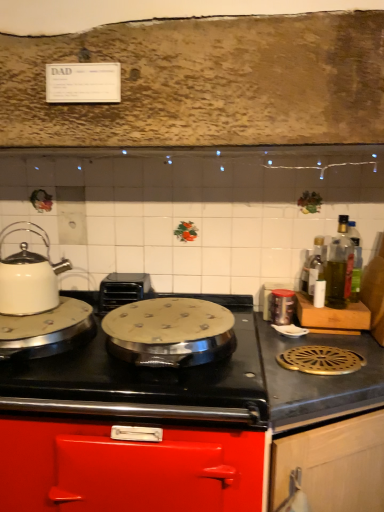
Question: From the image's perspective, is metallic red cabinet at center, the 1th cabinetry positioned from the left, above green glass bottle at right, positioned as the first bottle in right-to-left order?

Choices:
 (A) yes
 (B) no

Answer: (B)

Question: From a real-world perspective, is metallic red cabinet at center, the 1th cabinetry positioned from the left, under green glass bottle at right, the 3th bottle viewed from the left?

Choices:
 (A) no
 (B) yes

Answer: (B)

Question: Is metallic red cabinet at center, the 1th cabinetry positioned from the left, further to the viewer compared to green glass bottle at right, positioned as the first bottle in right-to-left order?

Choices:
 (A) yes
 (B) no

Answer: (B)

Question: Considering the relative positions of metallic red cabinet at center, which is the 2th cabinetry in right-to-left order, and green glass bottle at right, the 3th bottle viewed from the left, in the image provided, is metallic red cabinet at center, which is the 2th cabinetry in right-to-left order, to the left of green glass bottle at right, the 3th bottle viewed from the left, from the viewer's perspective?

Choices:
 (A) no
 (B) yes

Answer: (B)

Question: Is metallic red cabinet at center, which is the 2th cabinetry in right-to-left order, far away from green glass bottle at right, positioned as the first bottle in right-to-left order?

Choices:
 (A) yes
 (B) no

Answer: (B)

Question: Choose the correct answer: Is metallic canister at right, arranged as the 1th kitchen appliance when viewed from the right, inside metallic gray stovetop at right or outside it?

Choices:
 (A) inside
 (B) outside

Answer: (B)

Question: From the image's perspective, relative to metallic gray stovetop at right, is metallic canister at right, arranged as the 1th kitchen appliance when viewed from the right, above or below?

Choices:
 (A) above
 (B) below

Answer: (A)

Question: From a real-world perspective, is metallic canister at right, positioned as the 2th kitchen appliance in front-to-back order, physically located above or below metallic gray stovetop at right?

Choices:
 (A) below
 (B) above

Answer: (B)

Question: Looking at the image, does metallic canister at right, positioned as the 2th kitchen appliance in front-to-back order, seem bigger or smaller compared to metallic gray stovetop at right?

Choices:
 (A) big
 (B) small

Answer: (B)

Question: Considering the positions of wooden cabinet door at lower right, arranged as the second cabinetry when viewed from the left, and metallic canister at right, the second kitchen appliance when ordered from left to right, in the image, is wooden cabinet door at lower right, arranged as the second cabinetry when viewed from the left, bigger or smaller than metallic canister at right, the second kitchen appliance when ordered from left to right,?

Choices:
 (A) big
 (B) small

Answer: (A)

Question: Considering the positions of wooden cabinet door at lower right, arranged as the second cabinetry when viewed from the left, and metallic canister at right, positioned as the 2th kitchen appliance in front-to-back order, in the image, is wooden cabinet door at lower right, arranged as the second cabinetry when viewed from the left, taller or shorter than metallic canister at right, positioned as the 2th kitchen appliance in front-to-back order,?

Choices:
 (A) short
 (B) tall

Answer: (B)

Question: Is wooden cabinet door at lower right, arranged as the second cabinetry when viewed from the left, in front of or behind metallic canister at right, the 1th kitchen appliance viewed from the back, in the image?

Choices:
 (A) behind
 (B) front

Answer: (B)

Question: Would you say wooden cabinet door at lower right, the 1th cabinetry viewed from the right, is to the left or to the right of metallic canister at right, the second kitchen appliance when ordered from left to right, in the picture?

Choices:
 (A) left
 (B) right

Answer: (A)

Question: From a real-world perspective, is green glass bottle at right, positioned as the first bottle in right-to-left order, physically located above or below silver metallic wok at center?

Choices:
 (A) above
 (B) below

Answer: (A)

Question: Considering the positions of green glass bottle at right, the 3th bottle viewed from the left, and silver metallic wok at center in the image, is green glass bottle at right, the 3th bottle viewed from the left, taller or shorter than silver metallic wok at center?

Choices:
 (A) tall
 (B) short

Answer: (A)